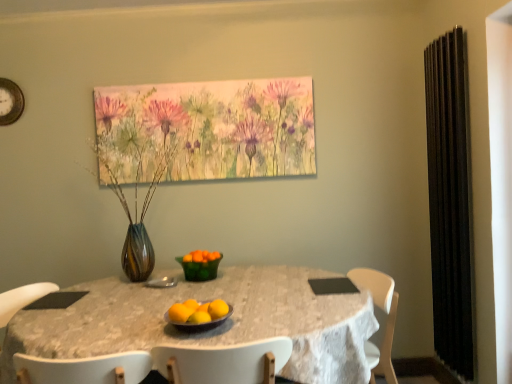
Question: From a real-world perspective, is multicolored glass vase with dried stems at center positioned above or below orange matte at center, acting as the 1th orange starting from the left?

Choices:
 (A) above
 (B) below

Answer: (A)

Question: Is multicolored glass vase with dried stems at center wider or thinner than orange matte at center, which is the third orange in back-to-front order?

Choices:
 (A) wide
 (B) thin

Answer: (A)

Question: Estimate the real-world distances between objects in this image. Which object is farther from the orange matte at center, acting as the first orange starting from the back?

Choices:
 (A) orange matte at center, which appears as the second orange when viewed from the front
 (B) gold metallic clock at upper left
 (C) white lace tablecloth at center
 (D) green glass bowl at center
 (E) orange matte at center, acting as the 1th orange starting from the left

Answer: (B)

Question: Which is farther from the green glass bowl at center?

Choices:
 (A) black metal radiator at right
 (B) multicolored glass vase with dried stems at center
 (C) orange matte at center, which appears as the 1th orange when viewed from the front
 (D) gold metallic clock at upper left
 (E) shiny metallic bowl at center

Answer: (D)